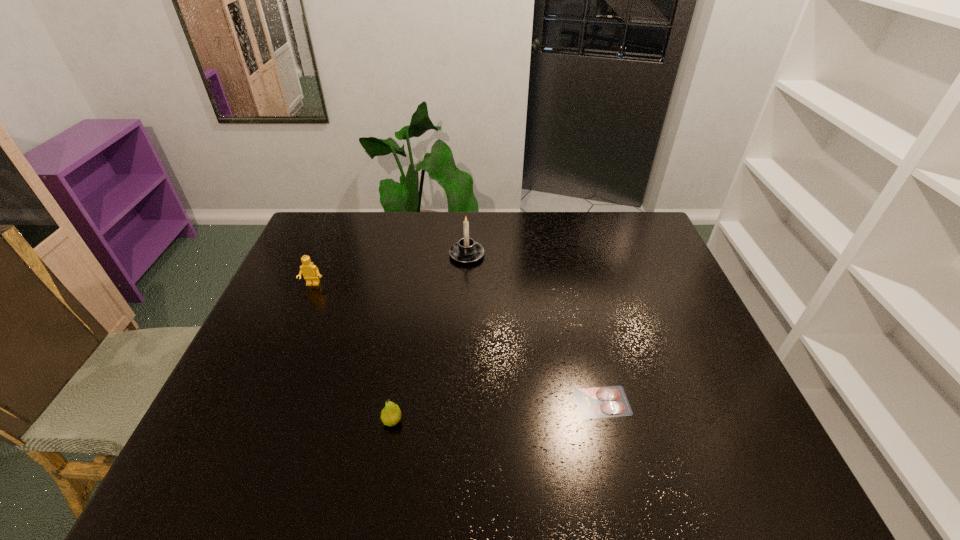
Where is `free space at the near right corner of the desktop`? free space at the near right corner of the desktop is located at coordinates (732, 464).

Find the location of a particular element. This screenshot has width=960, height=540. free point between the second farthest object and the second object from right to left is located at coordinates click(390, 269).

You are a GUI agent. You are given a task and a screenshot of the screen. Output one action in this format:
    pyautogui.click(x=<x>, y=<y>)
    Task: Click on the free spot between the tallest object and the shortest object
    This screenshot has height=540, width=960.
    Given the screenshot: What is the action you would take?
    pyautogui.click(x=535, y=328)

At what (x,y) coordinates should I click in order to perform the action: click on empty space that is in between the third tallest object and the rightmost object. Please return your answer as a coordinate pair (x, y). Looking at the image, I should click on (497, 411).

Identify the location of vacant space in between the shortest object and the third object from right to left. Image resolution: width=960 pixels, height=540 pixels. (497, 411).

Locate an element on the screen. The height and width of the screenshot is (540, 960). vacant area that lies between the second shortest object and the second object from right to left is located at coordinates (429, 338).

Identify the location of empty space that is in between the candle holder and the pear. (429, 338).

Locate an element on the screen. This screenshot has width=960, height=540. free spot between the shortest object and the farthest object is located at coordinates (535, 328).

Locate an element on the screen. vacant space that is in between the third tallest object and the candle holder is located at coordinates (429, 338).

The image size is (960, 540). In order to click on free area in between the third object from right to left and the shortest object in this screenshot , I will do coord(497,411).